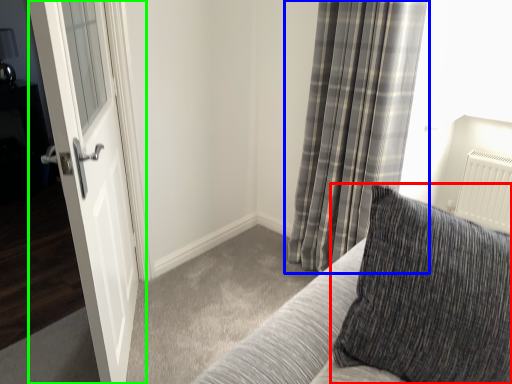
Question: Which object is positioned closest to pillow (highlighted by a red box)? Select from curtain (highlighted by a blue box) and door (highlighted by a green box).

Choices:
 (A) curtain
 (B) door

Answer: (B)